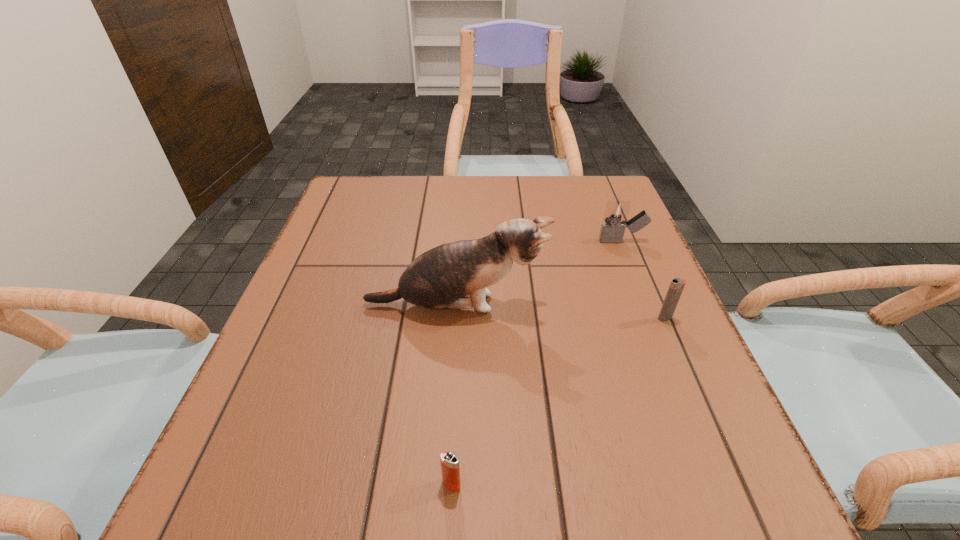
Where is `cat`? The height and width of the screenshot is (540, 960). cat is located at coordinates (444, 277).

Where is `the farthest object`? the farthest object is located at coordinates (612, 231).

Where is `the second farthest igniter`? The image size is (960, 540). the second farthest igniter is located at coordinates click(x=676, y=287).

Find the location of a particular element. the shortest igniter is located at coordinates (449, 461).

At what (x,y) coordinates should I click in order to perform the action: click on the leftmost igniter. Please return your answer as a coordinate pair (x, y). Looking at the image, I should click on (449, 461).

Image resolution: width=960 pixels, height=540 pixels. Identify the location of blank space located 0.080m at the face of the cat. (586, 305).

The height and width of the screenshot is (540, 960). Find the location of `vacant region located on the left of the farthest igniter`. vacant region located on the left of the farthest igniter is located at coordinates (508, 241).

The height and width of the screenshot is (540, 960). Identify the location of vacant area situated on the left of the second nearest igniter. (632, 318).

You are a GUI agent. You are given a task and a screenshot of the screen. Output one action in this format:
    pyautogui.click(x=<x>, y=<y>)
    Task: Click on the blank space located on the back of the shortest object
    The image size is (960, 540).
    Given the screenshot: What is the action you would take?
    pyautogui.click(x=457, y=379)

Locate an element on the screen. The width and height of the screenshot is (960, 540). object situated at the near edge is located at coordinates (449, 461).